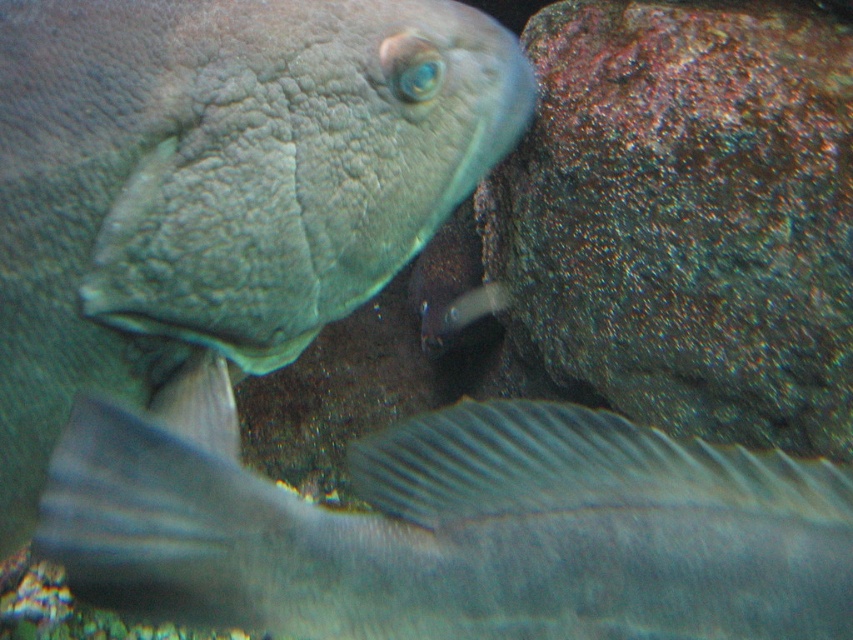
The image size is (853, 640). I want to click on smooth gray fish at upper left, so click(218, 184).

Is point (67, 77) behind point (222, 618)?

Yes, point (67, 77) is farther from viewer.

At what (x,y) coordinates should I click in order to perform the action: click on smooth gray fish at upper left. Please return your answer as a coordinate pair (x, y). The height and width of the screenshot is (640, 853). Looking at the image, I should click on (218, 184).

Is smooth gray fish at upper left shorter than rusty rock at right?

Indeed, smooth gray fish at upper left has a lesser height compared to rusty rock at right.

Can you confirm if smooth gray fish at upper left is positioned to the left of rusty rock at right?

Correct, you'll find smooth gray fish at upper left to the left of rusty rock at right.

Does point (189, 84) come farther from viewer compared to point (514, 268)?

No, (189, 84) is closer to viewer.

I want to click on smooth gray fish at upper left, so click(218, 184).

Between point (775, 627) and point (560, 13), which one is positioned in front?

Point (775, 627)

Locate an element on the screen. Image resolution: width=853 pixels, height=640 pixels. silvery textured fish at lower center is located at coordinates (461, 532).